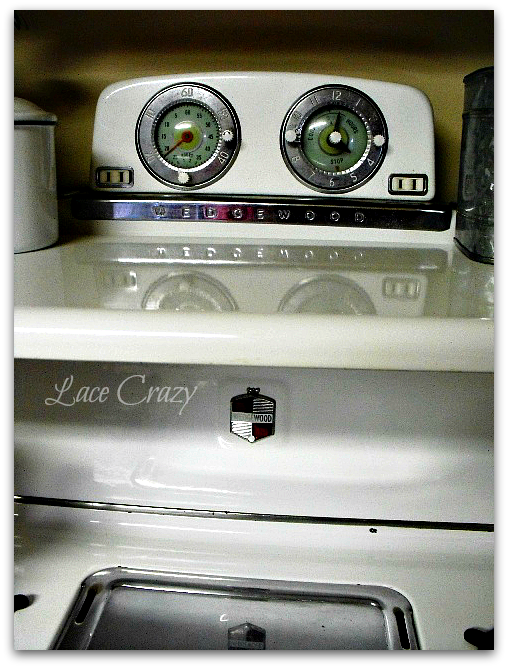
This screenshot has height=668, width=508. In order to click on vintage stove in this screenshot , I will do `click(259, 255)`.